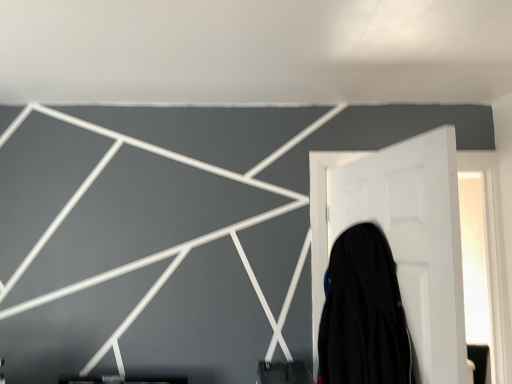
Question: Is black fabric at right positioned with its back to white matte door at right?

Choices:
 (A) yes
 (B) no

Answer: (A)

Question: Can white matte door at right be found inside black fabric at right?

Choices:
 (A) yes
 (B) no

Answer: (B)

Question: Considering the relative sizes of black fabric at right and white matte door at right in the image provided, is black fabric at right taller than white matte door at right?

Choices:
 (A) yes
 (B) no

Answer: (B)

Question: Can you confirm if black fabric at right is positioned to the left of white matte door at right?

Choices:
 (A) yes
 (B) no

Answer: (A)

Question: From a real-world perspective, is black fabric at right located beneath white matte door at right?

Choices:
 (A) no
 (B) yes

Answer: (B)

Question: Is black fabric at right closer to camera compared to white matte door at right?

Choices:
 (A) no
 (B) yes

Answer: (A)

Question: Is white matte door at right facing towards black fabric at right?

Choices:
 (A) yes
 (B) no

Answer: (A)

Question: Is white matte door at right positioned before black fabric at right?

Choices:
 (A) no
 (B) yes

Answer: (B)

Question: Is white matte door at right oriented away from black fabric at right?

Choices:
 (A) no
 (B) yes

Answer: (B)

Question: Does white matte door at right have a larger size compared to black fabric at right?

Choices:
 (A) no
 (B) yes

Answer: (B)

Question: Considering the relative positions of white matte door at right and black fabric at right in the image provided, is white matte door at right to the right of black fabric at right from the viewer's perspective?

Choices:
 (A) yes
 (B) no

Answer: (A)

Question: From a real-world perspective, is white matte door at right over black fabric at right?

Choices:
 (A) yes
 (B) no

Answer: (A)

Question: Relative to black fabric at right, is white matte door at right in front or behind?

Choices:
 (A) front
 (B) behind

Answer: (A)